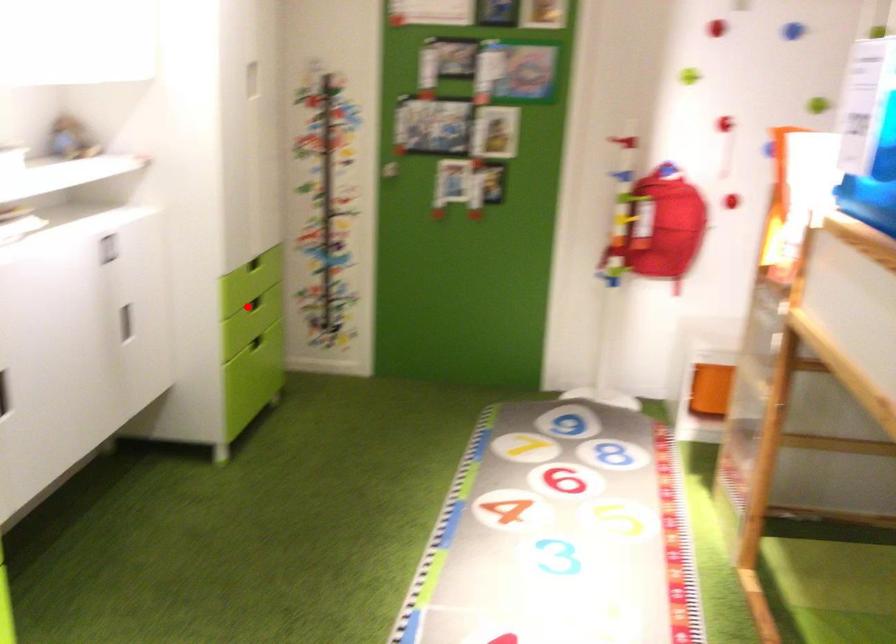
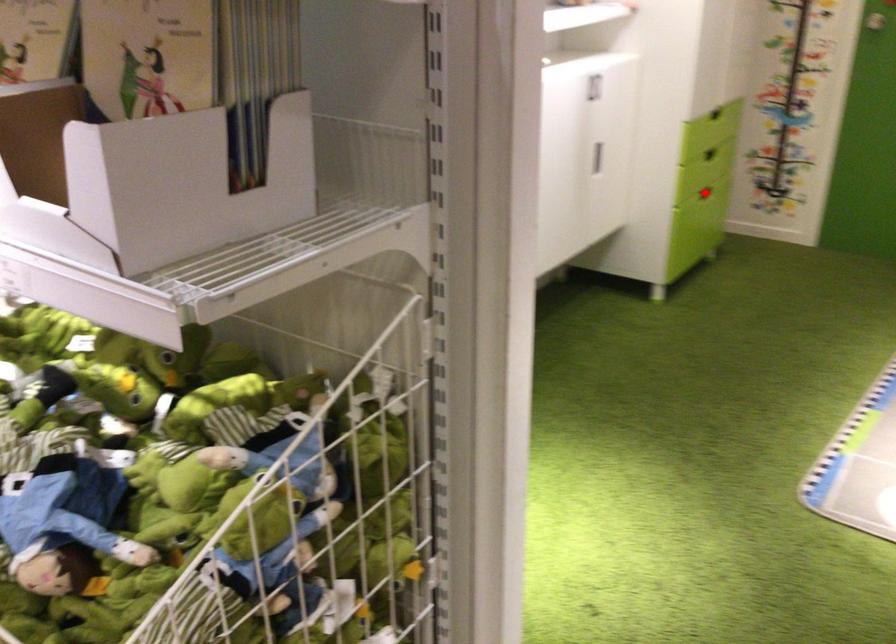
I am providing you with two images of the same scene from different viewpoints. A red point is marked on the first image and another point is marked on the second image. Does the point marked in image1 correspond to the same location as the one in image2?

No